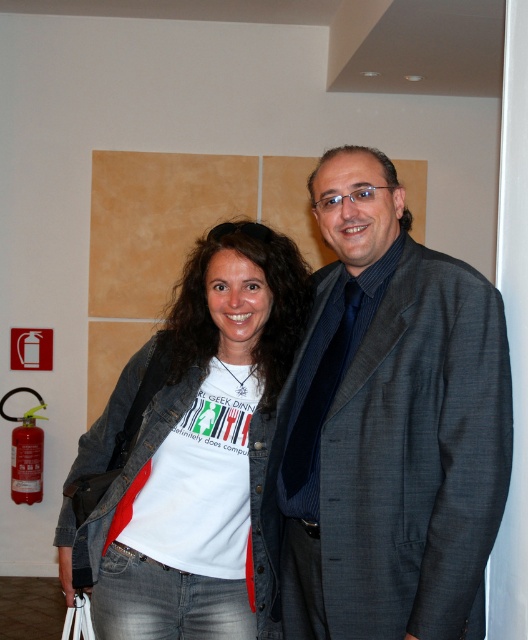
Which is above, dark gray suit at center or white cotton t-shirt at center?

dark gray suit at center

I want to click on dark gray suit at center, so click(x=389, y=426).

In order to click on dark gray suit at center in this screenshot , I will do point(389,426).